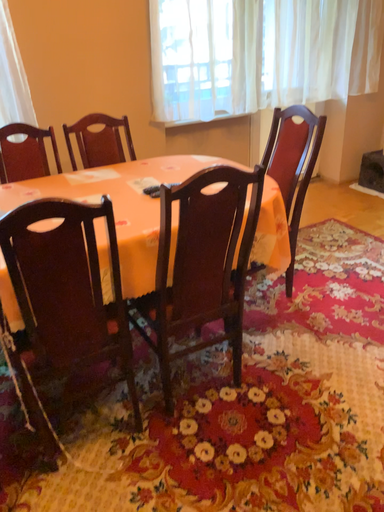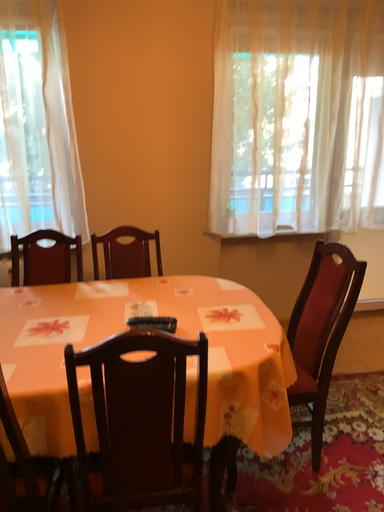
Question: How did the camera likely rotate when shooting the video?

Choices:
 (A) rotated upward
 (B) rotated downward

Answer: (A)